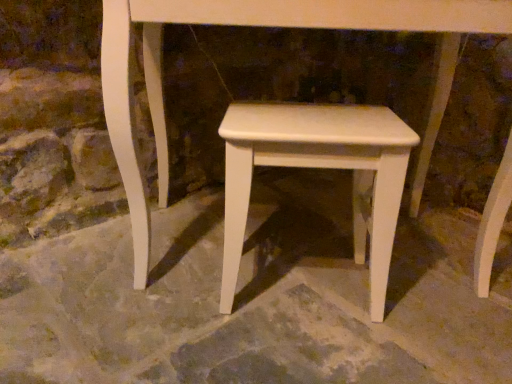
This screenshot has height=384, width=512. I want to click on vacant space behind white matte stool at center, so click(298, 234).